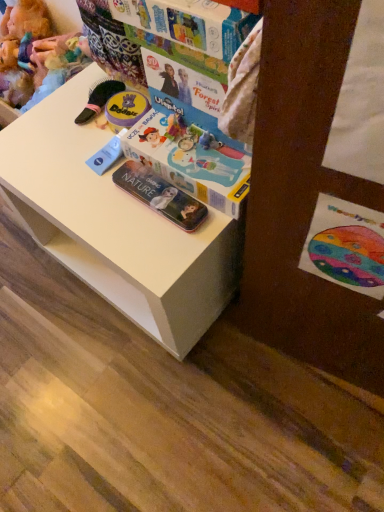
Find the location of `free space to the left of transparent plastic case at lower center`. free space to the left of transparent plastic case at lower center is located at coordinates (84, 199).